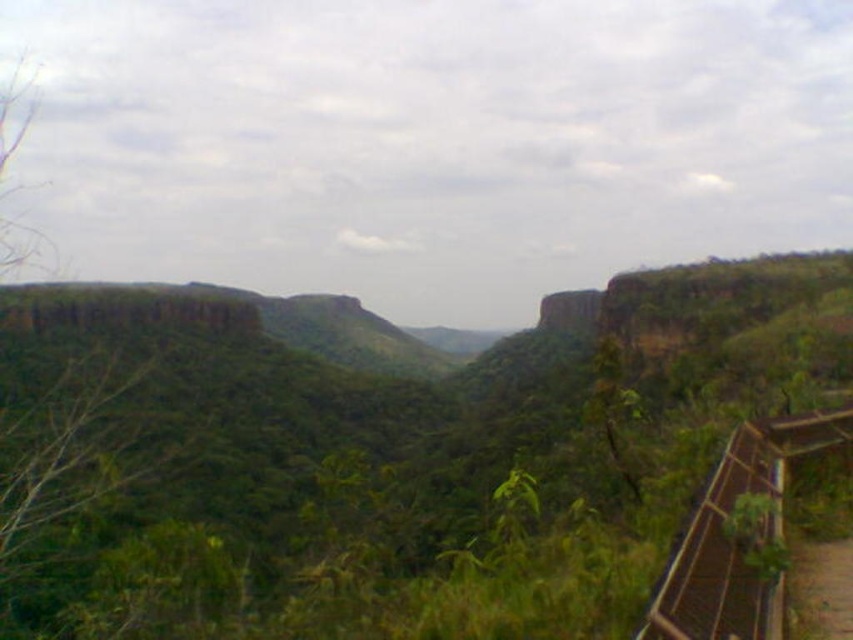
Question: Is green leafy vegetation at center thinner than brown wooden path at lower right?

Choices:
 (A) no
 (B) yes

Answer: (A)

Question: Can you confirm if green leafy vegetation at center is thinner than brown wooden path at lower right?

Choices:
 (A) yes
 (B) no

Answer: (B)

Question: Which point is farther to the camera?

Choices:
 (A) green leafy vegetation at center
 (B) brown wooden path at lower right

Answer: (A)

Question: Is green leafy vegetation at center wider than brown wooden path at lower right?

Choices:
 (A) yes
 (B) no

Answer: (A)